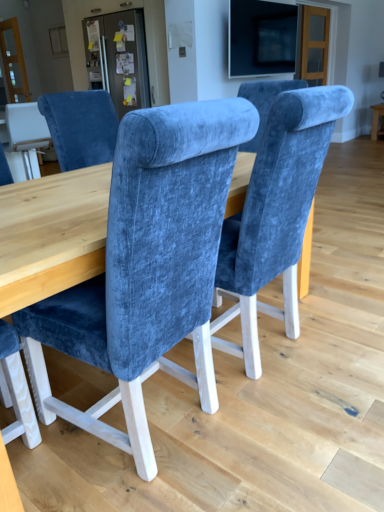
Question: From a real-world perspective, is matte wood table at right positioned under velvet blue chair at center based on gravity?

Choices:
 (A) no
 (B) yes

Answer: (B)

Question: Does matte wood table at right have a smaller size compared to velvet blue chair at center?

Choices:
 (A) yes
 (B) no

Answer: (A)

Question: Considering the relative sizes of matte wood table at right and velvet blue chair at center in the image provided, is matte wood table at right thinner than velvet blue chair at center?

Choices:
 (A) yes
 (B) no

Answer: (A)

Question: Is matte wood table at right next to velvet blue chair at center?

Choices:
 (A) yes
 (B) no

Answer: (B)

Question: Does matte wood table at right have a lesser height compared to velvet blue chair at center?

Choices:
 (A) yes
 (B) no

Answer: (A)

Question: From the image's perspective, is matte black screen at upper center above or below velvet blue chair at center?

Choices:
 (A) above
 (B) below

Answer: (A)

Question: Is matte black screen at upper center taller or shorter than velvet blue chair at center?

Choices:
 (A) tall
 (B) short

Answer: (B)

Question: Choose the correct answer: Is matte black screen at upper center inside velvet blue chair at center or outside it?

Choices:
 (A) inside
 (B) outside

Answer: (B)

Question: In terms of size, does matte black screen at upper center appear bigger or smaller than velvet blue chair at center?

Choices:
 (A) big
 (B) small

Answer: (B)

Question: From a real-world perspective, is matte wood table at right above or below matte black screen at upper center?

Choices:
 (A) below
 (B) above

Answer: (A)

Question: In the image, is matte wood table at right positioned in front of or behind matte black screen at upper center?

Choices:
 (A) front
 (B) behind

Answer: (B)

Question: From the image's perspective, is matte wood table at right positioned above or below matte black screen at upper center?

Choices:
 (A) above
 (B) below

Answer: (B)

Question: Considering the relative positions of matte wood table at right and matte black screen at upper center in the image provided, is matte wood table at right to the left or to the right of matte black screen at upper center?

Choices:
 (A) right
 (B) left

Answer: (A)

Question: Considering the positions of point (200, 194) and point (375, 130), is point (200, 194) closer or farther from the camera than point (375, 130)?

Choices:
 (A) closer
 (B) farther

Answer: (A)

Question: In the image, is velvet blue chair at center on the left side or the right side of matte wood table at right?

Choices:
 (A) left
 (B) right

Answer: (A)